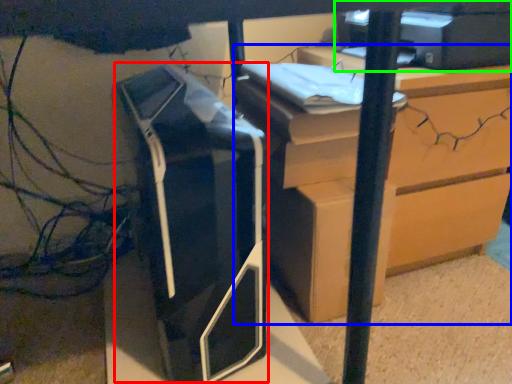
Question: Which object is the closest to the printer (highlighted by a red box)? Choose among these: chest of drawers (highlighted by a blue box) or printer (highlighted by a green box).

Choices:
 (A) chest of drawers
 (B) printer

Answer: (A)